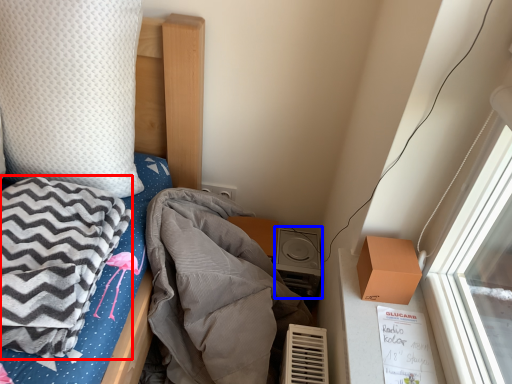
Question: Which object is closer to the camera taking this photo, blanket (highlighted by a red box) or stereo (highlighted by a blue box)?

Choices:
 (A) blanket
 (B) stereo

Answer: (A)